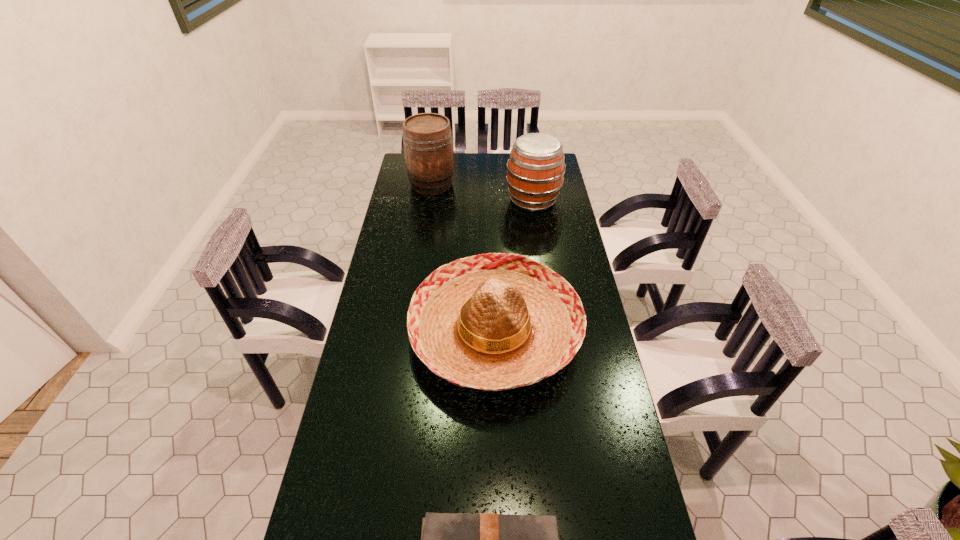
At what (x,y) coordinates should I click in order to perform the action: click on free location that satisfies the following two spatial constraints: 1. on the side of the left cider near the bung hole; 2. on the back side of the second nearest object. Please return your answer as a coordinate pair (x, y). The image size is (960, 540). Looking at the image, I should click on (411, 332).

Find the location of `free spot that satisfies the following two spatial constraints: 1. on the side of the sombrero near the bung hole; 2. on the left side of the left cider`. free spot that satisfies the following two spatial constraints: 1. on the side of the sombrero near the bung hole; 2. on the left side of the left cider is located at coordinates click(411, 332).

Identify the location of vacant space that satisfies the following two spatial constraints: 1. on the back side of the right cider; 2. on the side of the left cider near the bung hole. The height and width of the screenshot is (540, 960). (531, 184).

Where is `free spot that satisfies the following two spatial constraints: 1. on the side of the right cider near the bung hole; 2. on the right side of the left cider`? The width and height of the screenshot is (960, 540). free spot that satisfies the following two spatial constraints: 1. on the side of the right cider near the bung hole; 2. on the right side of the left cider is located at coordinates (429, 200).